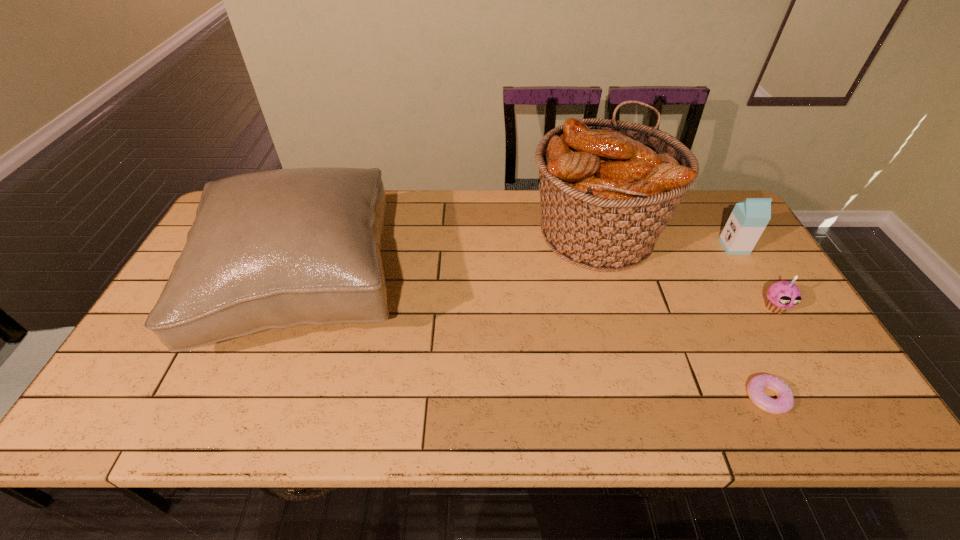
Where is `blank area at the far edge`? The image size is (960, 540). blank area at the far edge is located at coordinates (675, 234).

In order to click on vacant space at the near edge of the desktop in this screenshot , I will do `click(445, 400)`.

The width and height of the screenshot is (960, 540). In the image, there is a desktop. What are the coordinates of `free space at the left edge` in the screenshot? It's located at (146, 369).

This screenshot has width=960, height=540. In the image, there is a desktop. Find the location of `vacant space at the right edge`. vacant space at the right edge is located at coordinates (844, 392).

This screenshot has width=960, height=540. In the image, there is a desktop. Identify the location of vacant space at the near left corner. (150, 420).

Image resolution: width=960 pixels, height=540 pixels. Find the location of `vacant region at the far right corner of the desktop`. vacant region at the far right corner of the desktop is located at coordinates (703, 194).

The image size is (960, 540). In order to click on vacant area that lies between the cupcake and the basket in this screenshot , I will do `click(686, 271)`.

Image resolution: width=960 pixels, height=540 pixels. What are the coordinates of `free space between the basket and the leftmost object` in the screenshot? It's located at (451, 261).

What are the coordinates of `free space between the cushion and the milk carton` in the screenshot? It's located at (519, 267).

At what (x,y) coordinates should I click in order to perform the action: click on free spot between the basket and the third object from right to left. Please return your answer as a coordinate pair (x, y). Image resolution: width=960 pixels, height=540 pixels. Looking at the image, I should click on (682, 316).